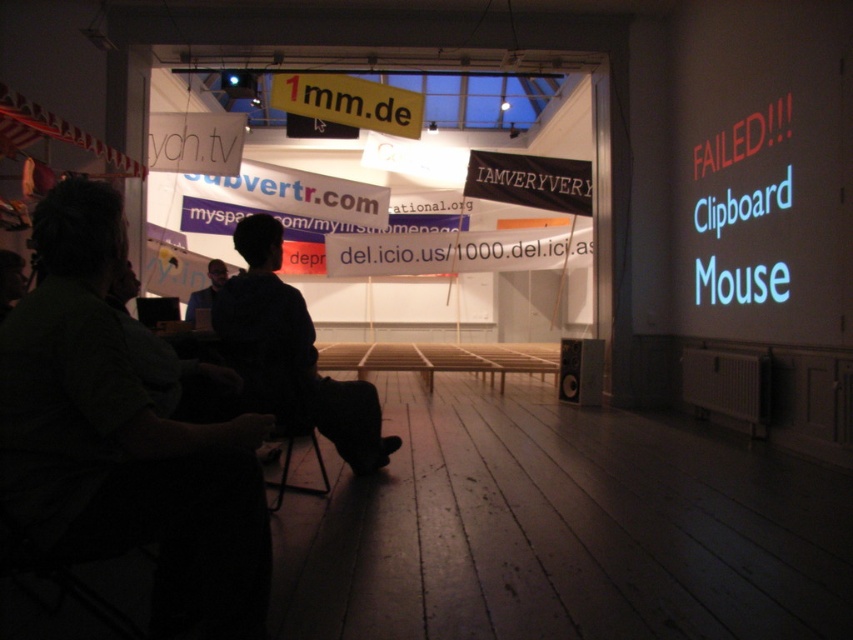
You are standing in the gallery and want to take a photo of both the point at (225, 348) and the point at (187, 307). Which point should you focus on first to ensure both are in sharp focus?

You should focus on the point at (187, 307) first because it is farther from the camera than the point at (225, 348). By focusing on the farther point, both points will be within the depth of field and in sharp focus.

Looking at this image, you are an event planner trying to arrange seating for an upcoming presentation. You notice the dark green shirt at left and the black fabric chair at lower center in the image. Which object is closer to the front of the room?

The dark green shirt at left is closer to the front of the room because it is in front of the black fabric chair at lower center.